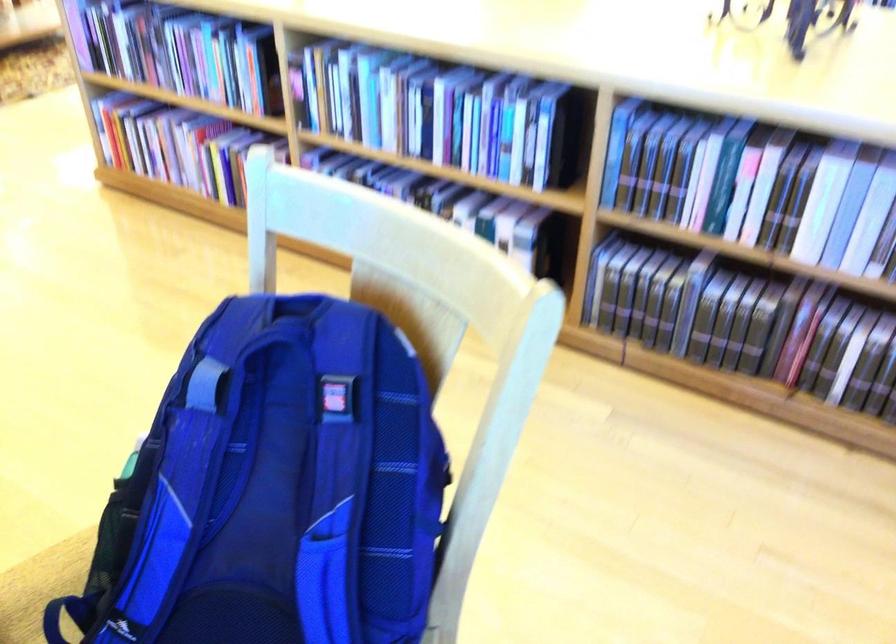
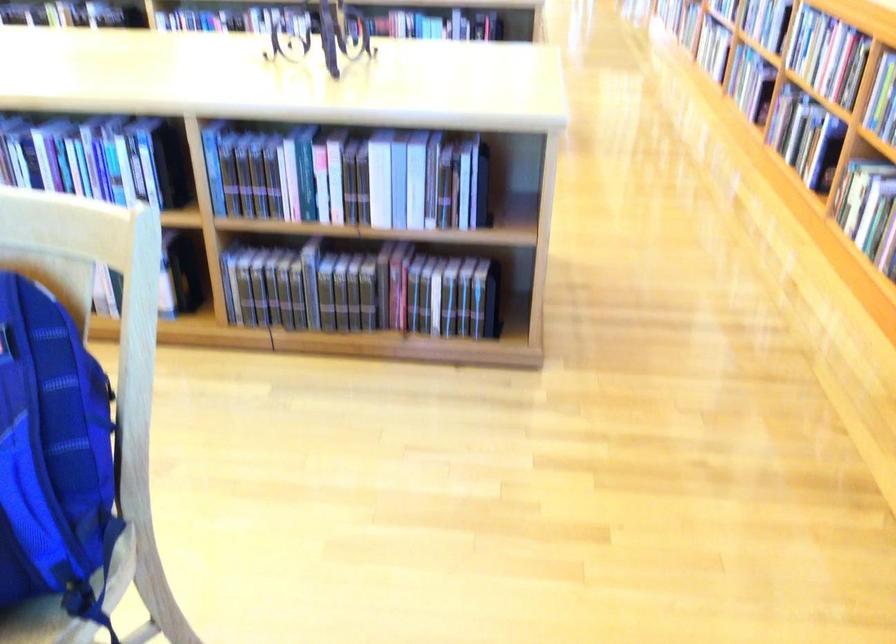
The point at (366, 561) is marked in the first image. Where is the corresponding point in the second image?

(53, 458)